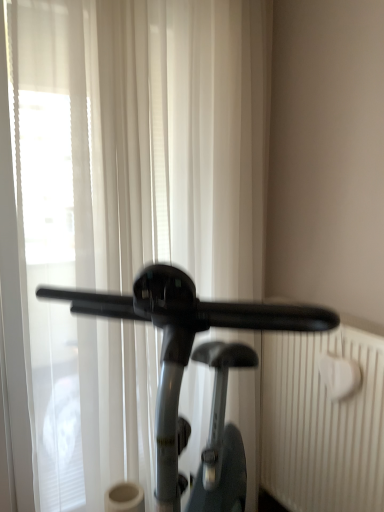
Locate an element on the screen. This screenshot has width=384, height=512. black glossy stationary bicycle at center is located at coordinates (183, 344).

What are the coordinates of `white sheer curtain at center` in the screenshot? It's located at (134, 199).

Is white sheer curtain at center completely or partially outside of black glossy stationary bicycle at center?

Yes.

Are white sheer curtain at center and black glossy stationary bicycle at center far apart?

No, white sheer curtain at center is in close proximity to black glossy stationary bicycle at center.

Considering the relative sizes of white sheer curtain at center and black glossy stationary bicycle at center in the image provided, is white sheer curtain at center thinner than black glossy stationary bicycle at center?

Yes.

From a real-world perspective, does white sheer curtain at center stand above black glossy stationary bicycle at center?

Yes, from a real-world perspective, white sheer curtain at center is above black glossy stationary bicycle at center.

Can you tell me how much white textured radiator at right and black glossy stationary bicycle at center differ in facing direction?

white textured radiator at right and black glossy stationary bicycle at center are facing 40.4 degrees away from each other.

Where is `stationary bicycle that is on the left side of white textured radiator at right`? This screenshot has height=512, width=384. stationary bicycle that is on the left side of white textured radiator at right is located at coordinates 183,344.

Between white textured radiator at right and black glossy stationary bicycle at center, which one has more height?

With more height is black glossy stationary bicycle at center.

Looking at this image, could you tell me if white textured radiator at right is facing black glossy stationary bicycle at center?

Yes, white textured radiator at right is aimed at black glossy stationary bicycle at center.

Can we say black glossy stationary bicycle at center lies outside white sheer curtain at center?

black glossy stationary bicycle at center lies outside white sheer curtain at center's area.

Based on the photo, in terms of width, does black glossy stationary bicycle at center look wider or thinner when compared to white sheer curtain at center?

In the image, black glossy stationary bicycle at center appears to be wider than white sheer curtain at center.

Does black glossy stationary bicycle at center turn towards white sheer curtain at center?

No, black glossy stationary bicycle at center is not facing towards white sheer curtain at center.

From a real-world perspective, which object rests below the other?

From a 3D spatial view, black glossy stationary bicycle at center is below.

At what (x,y) coordinates should I click in order to perform the action: click on curtain above the white textured radiator at right (from the image's perspective). Please return your answer as a coordinate pair (x, y). Image resolution: width=384 pixels, height=512 pixels. Looking at the image, I should click on (134, 199).

Is white sheer curtain at center oriented away from white textured radiator at right?

white sheer curtain at center is not turned away from white textured radiator at right.

From a real-world perspective, is white sheer curtain at center positioned under white textured radiator at right based on gravity?

Actually, white sheer curtain at center is physically above white textured radiator at right in the real world.

How many degrees apart are the facing directions of black glossy stationary bicycle at center and white textured radiator at right?

There is a 40.4-degree angle between the facing directions of black glossy stationary bicycle at center and white textured radiator at right.

Considering the sizes of objects black glossy stationary bicycle at center and white textured radiator at right in the image provided, who is taller, black glossy stationary bicycle at center or white textured radiator at right?

With more height is black glossy stationary bicycle at center.

From a real-world perspective, is black glossy stationary bicycle at center under white textured radiator at right?

Actually, black glossy stationary bicycle at center is physically above white textured radiator at right in the real world.

Does white textured radiator at right turn towards white sheer curtain at center?

Yes, white textured radiator at right is oriented towards white sheer curtain at center.

Measure the distance between white textured radiator at right and white sheer curtain at center.

white textured radiator at right is 28.70 inches from white sheer curtain at center.

From the picture: Do you think white textured radiator at right is within white sheer curtain at center, or outside of it?

white textured radiator at right is not enclosed by white sheer curtain at center.

Is point (292, 408) farther from camera compared to point (31, 186)?

Yes, point (292, 408) is farther from viewer.

Locate an element on the screen. curtain located above the black glossy stationary bicycle at center (from the image's perspective) is located at coordinates (134, 199).

The height and width of the screenshot is (512, 384). Find the location of `stationary bicycle in front of the white textured radiator at right`. stationary bicycle in front of the white textured radiator at right is located at coordinates (183, 344).

Looking at the image, which one is located closer to white textured radiator at right, black glossy stationary bicycle at center or white sheer curtain at center?

black glossy stationary bicycle at center is positioned closer to the anchor white textured radiator at right.

Considering their positions, is black glossy stationary bicycle at center positioned closer to white sheer curtain at center than white textured radiator at right?

black glossy stationary bicycle at center is positioned closer to the anchor white sheer curtain at center.

When comparing their distances from black glossy stationary bicycle at center, does white sheer curtain at center or white textured radiator at right seem closer?

The object closer to black glossy stationary bicycle at center is white textured radiator at right.

From the image, which object appears to be nearer to black glossy stationary bicycle at center, white textured radiator at right or white sheer curtain at center?

white textured radiator at right is closer to black glossy stationary bicycle at center.

Considering their positions, is white sheer curtain at center positioned closer to white textured radiator at right than black glossy stationary bicycle at center?

Based on the image, black glossy stationary bicycle at center appears to be nearer to white textured radiator at right.

Which object lies nearer to the anchor point white sheer curtain at center, white textured radiator at right or black glossy stationary bicycle at center?

Based on the image, black glossy stationary bicycle at center appears to be nearer to white sheer curtain at center.

Find the location of a particular element. stationary bicycle between white sheer curtain at center and white textured radiator at right in the horizontal direction is located at coordinates (183, 344).